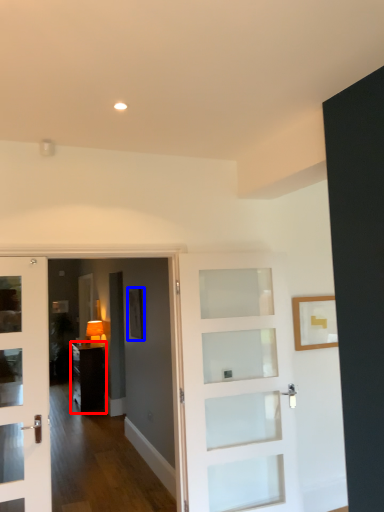
Question: Which object is closer to the camera taking this photo, furniture (highlighted by a red box) or picture frame (highlighted by a blue box)?

Choices:
 (A) furniture
 (B) picture frame

Answer: (B)